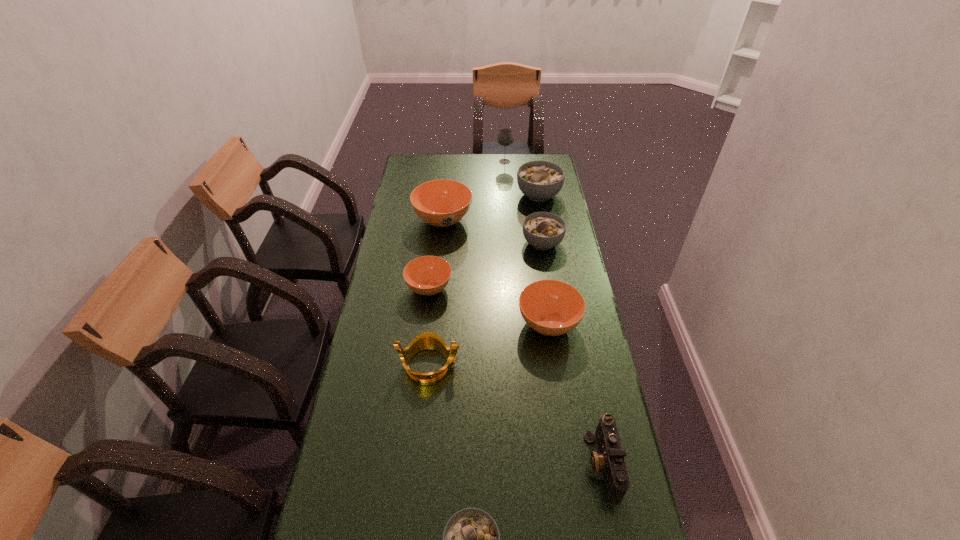
Locate an element on the screen. wineglass is located at coordinates (505, 137).

This screenshot has width=960, height=540. Identify the location of gray wineglass. (505, 137).

The width and height of the screenshot is (960, 540). I want to click on the biggest white soup bowl, so click(x=539, y=180).

I want to click on the farthest peach soup bowl, so click(441, 203).

Locate an element on the screen. The height and width of the screenshot is (540, 960). gold tiara is located at coordinates (427, 340).

What are the coordinates of `the second biggest peach soup bowl` in the screenshot? It's located at (550, 307).

Where is `the second farthest white soup bowl`? The width and height of the screenshot is (960, 540). the second farthest white soup bowl is located at coordinates (543, 230).

At what (x,y) coordinates should I click in order to perform the action: click on camera. Please return your answer as a coordinate pair (x, y). Looking at the image, I should click on (610, 460).

The image size is (960, 540). In order to click on the smallest peach soup bowl in this screenshot , I will do `click(428, 275)`.

You are a GUI agent. You are given a task and a screenshot of the screen. Output one action in this format:
    pyautogui.click(x=<x>, y=<y>)
    Task: Click on the free space located on the left of the tallest object
    
    Given the screenshot: What is the action you would take?
    pyautogui.click(x=481, y=161)